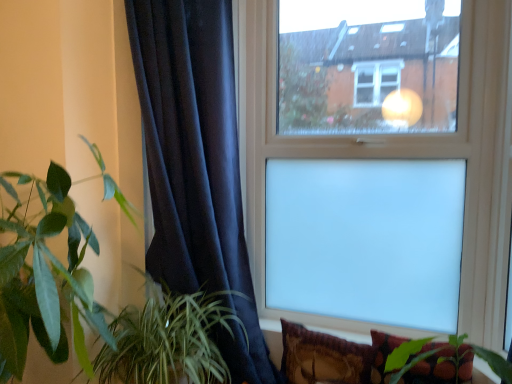
From the picture: What is the approximate width of velvet floral pillow at lower right, the 2th pillow positioned from the left?

velvet floral pillow at lower right, the 2th pillow positioned from the left, is 3.59 inches wide.

Where is `velvet-like brown pillow at lower right, placed as the 1th pillow when sorted from left to right`? velvet-like brown pillow at lower right, placed as the 1th pillow when sorted from left to right is located at coordinates (323, 357).

Describe the element at coordinates (197, 165) in the screenshot. I see `velvet dark blue curtain at left` at that location.

The height and width of the screenshot is (384, 512). In order to click on velvet dark blue curtain at left in this screenshot , I will do `click(197, 165)`.

What is the approximate width of green leafy plant at left, acting as the first houseplant starting from the left?

The width of green leafy plant at left, acting as the first houseplant starting from the left, is 30.89 inches.

The width and height of the screenshot is (512, 384). Find the location of `velvet floral pillow at lower right, which is counted as the first pillow, starting from the right`. velvet floral pillow at lower right, which is counted as the first pillow, starting from the right is located at coordinates (441, 366).

Is point (444, 383) less distant than point (11, 334)?

No.

How many degrees apart are the facing directions of velvet floral pillow at lower right, the 2th pillow positioned from the left, and green leafy plant at left, which is the 2th houseplant in right-to-left order?

0.24 degrees separate the facing orientations of velvet floral pillow at lower right, the 2th pillow positioned from the left, and green leafy plant at left, which is the 2th houseplant in right-to-left order.

From the image's perspective, is velvet floral pillow at lower right, which is counted as the first pillow, starting from the right, on top of green leafy plant at left, which is the 2th houseplant in right-to-left order?

No, from the image's perspective, velvet floral pillow at lower right, which is counted as the first pillow, starting from the right, is not above green leafy plant at left, which is the 2th houseplant in right-to-left order.

Is velvet floral pillow at lower right, which is counted as the first pillow, starting from the right, at the left side of green leafy plant at left, which is the 2th houseplant in right-to-left order?

No.

Looking at this image, is velvet floral pillow at lower right, which is counted as the first pillow, starting from the right, not close to transparent glass window at upper center?

That's not correct — velvet floral pillow at lower right, which is counted as the first pillow, starting from the right, is a little close to transparent glass window at upper center.

Which object is closer to the camera, velvet floral pillow at lower right, which is counted as the first pillow, starting from the right, or transparent glass window at upper center?

velvet floral pillow at lower right, which is counted as the first pillow, starting from the right, is more forward.

Does velvet floral pillow at lower right, which is counted as the first pillow, starting from the right, appear on the right side of transparent glass window at upper center?

Correct, you'll find velvet floral pillow at lower right, which is counted as the first pillow, starting from the right, to the right of transparent glass window at upper center.

The image size is (512, 384). In order to click on window above the velvet floral pillow at lower right, which is counted as the first pillow, starting from the right (from the image's perspective) in this screenshot , I will do tap(394, 157).

From the image's perspective, which object appears higher, velvet dark blue curtain at left or green leafy plant at left, acting as the first houseplant starting from the left?

From the image's view, velvet dark blue curtain at left is above.

Considering the relative sizes of velvet dark blue curtain at left and green leafy plant at left, which is the 2th houseplant in right-to-left order, in the image provided, is velvet dark blue curtain at left bigger than green leafy plant at left, which is the 2th houseplant in right-to-left order,?

No, velvet dark blue curtain at left is not bigger than green leafy plant at left, which is the 2th houseplant in right-to-left order.

Based on their positions, is velvet dark blue curtain at left located to the left or right of green leafy plant at left, acting as the first houseplant starting from the left?

In the image, velvet dark blue curtain at left appears on the right side of green leafy plant at left, acting as the first houseplant starting from the left.

Considering the relative sizes of velvet dark blue curtain at left and green leafy plant at left, which is the 2th houseplant in right-to-left order, in the image provided, is velvet dark blue curtain at left thinner than green leafy plant at left, which is the 2th houseplant in right-to-left order,?

Indeed, velvet dark blue curtain at left has a lesser width compared to green leafy plant at left, which is the 2th houseplant in right-to-left order.

Is green leafy plant at left, which is the 2th houseplant in right-to-left order, aimed at velvet floral pillow at lower right, the 2th pillow positioned from the left?

No, green leafy plant at left, which is the 2th houseplant in right-to-left order, is not oriented towards velvet floral pillow at lower right, the 2th pillow positioned from the left.

Does green leafy plant at left, which is the 2th houseplant in right-to-left order, lie in front of velvet floral pillow at lower right, the 2th pillow positioned from the left?

Yes, green leafy plant at left, which is the 2th houseplant in right-to-left order, is closer to the camera.

This screenshot has height=384, width=512. In order to click on the 2nd houseplant to the left of the velvet floral pillow at lower right, the 2th pillow positioned from the left, starting your count from the anchor in this screenshot , I will do `click(49, 270)`.

From a real-world perspective, is green leafy plant at left, which is the 2th houseplant in right-to-left order, physically below velvet floral pillow at lower right, the 2th pillow positioned from the left?

No.

Is point (343, 344) positioned behind point (89, 244)?

Yes, it is.

Is velvet-like brown pillow at lower right, placed as the 1th pillow when sorted from left to right, smaller than green leafy plant at left, acting as the first houseplant starting from the left?

Correct, velvet-like brown pillow at lower right, placed as the 1th pillow when sorted from left to right, occupies less space than green leafy plant at left, acting as the first houseplant starting from the left.

Where is `the 2nd pillow positioned below the green leafy plant at left, acting as the first houseplant starting from the left (from the image's perspective)`? The height and width of the screenshot is (384, 512). the 2nd pillow positioned below the green leafy plant at left, acting as the first houseplant starting from the left (from the image's perspective) is located at coordinates (323, 357).

Is velvet-like brown pillow at lower right, placed as the 1th pillow when sorted from left to right, positioned with its back to green leafy plant at left, acting as the first houseplant starting from the left?

No, velvet-like brown pillow at lower right, placed as the 1th pillow when sorted from left to right, is not facing away from green leafy plant at left, acting as the first houseplant starting from the left.

Is transparent glass window at upper center to the left or to the right of velvet-like brown pillow at lower right, positioned as the 2th pillow in right-to-left order, in the image?

Clearly, transparent glass window at upper center is on the right of velvet-like brown pillow at lower right, positioned as the 2th pillow in right-to-left order, in the image.

Relative to velvet-like brown pillow at lower right, placed as the 1th pillow when sorted from left to right, is transparent glass window at upper center in front or behind?

transparent glass window at upper center is positioned closer to the viewer than velvet-like brown pillow at lower right, placed as the 1th pillow when sorted from left to right.

Which of these two, transparent glass window at upper center or velvet-like brown pillow at lower right, placed as the 1th pillow when sorted from left to right, is smaller?

velvet-like brown pillow at lower right, placed as the 1th pillow when sorted from left to right.

Does green leafy plant at lower left, positioned as the second houseplant in left-to-right order, have a greater width compared to transparent glass window at upper center?

Indeed, green leafy plant at lower left, positioned as the second houseplant in left-to-right order, has a greater width compared to transparent glass window at upper center.

Is transparent glass window at upper center surrounded by green leafy plant at lower left, the 1th houseplant viewed from the right?

No.

Is green leafy plant at lower left, positioned as the second houseplant in left-to-right order, looking in the opposite direction of transparent glass window at upper center?

green leafy plant at lower left, positioned as the second houseplant in left-to-right order, is not turned away from transparent glass window at upper center.

Starting from the transparent glass window at upper center, which houseplant is the 1st one to the left? Please provide its 2D coordinates.

[(168, 339)]

Identify the location of the 1st pillow behind when counting from the green leafy plant at left, acting as the first houseplant starting from the left. (441, 366).

From the image's perspective, starting from the transparent glass window at upper center, which pillow is the 1st one below? Please provide its 2D coordinates.

[(441, 366)]

When comparing their distances from velvet dark blue curtain at left, does green leafy plant at left, which is the 2th houseplant in right-to-left order, or green leafy plant at lower left, the 1th houseplant viewed from the right, seem further?

green leafy plant at left, which is the 2th houseplant in right-to-left order, is further to velvet dark blue curtain at left.

Looking at the image, which one is located further to velvet floral pillow at lower right, which is counted as the first pillow, starting from the right, velvet-like brown pillow at lower right, placed as the 1th pillow when sorted from left to right, or transparent glass window at upper center?

transparent glass window at upper center.

When comparing their distances from green leafy plant at left, acting as the first houseplant starting from the left, does green leafy plant at lower left, the 1th houseplant viewed from the right, or velvet dark blue curtain at left seem further?

velvet dark blue curtain at left is further to green leafy plant at left, acting as the first houseplant starting from the left.

When comparing their distances from transparent glass window at upper center, does velvet dark blue curtain at left or green leafy plant at left, acting as the first houseplant starting from the left, seem further?

green leafy plant at left, acting as the first houseplant starting from the left, lies further to transparent glass window at upper center than the other object.

From the image, which object appears to be farther from green leafy plant at left, acting as the first houseplant starting from the left, transparent glass window at upper center or velvet dark blue curtain at left?

transparent glass window at upper center lies further to green leafy plant at left, acting as the first houseplant starting from the left, than the other object.

Considering their positions, is velvet floral pillow at lower right, which is counted as the first pillow, starting from the right, positioned further to green leafy plant at left, acting as the first houseplant starting from the left, than transparent glass window at upper center?

The object further to green leafy plant at left, acting as the first houseplant starting from the left, is transparent glass window at upper center.

Considering their positions, is velvet-like brown pillow at lower right, positioned as the 2th pillow in right-to-left order, positioned further to velvet floral pillow at lower right, the 2th pillow positioned from the left, than green leafy plant at left, acting as the first houseplant starting from the left?

green leafy plant at left, acting as the first houseplant starting from the left, lies further to velvet floral pillow at lower right, the 2th pillow positioned from the left, than the other object.

Looking at the image, which one is located closer to velvet floral pillow at lower right, which is counted as the first pillow, starting from the right, velvet dark blue curtain at left or green leafy plant at left, acting as the first houseplant starting from the left?

velvet dark blue curtain at left is positioned closer to the anchor velvet floral pillow at lower right, which is counted as the first pillow, starting from the right.

Where is `curtain between transparent glass window at upper center and velvet floral pillow at lower right, which is counted as the first pillow, starting from the right, from top to bottom`? This screenshot has width=512, height=384. curtain between transparent glass window at upper center and velvet floral pillow at lower right, which is counted as the first pillow, starting from the right, from top to bottom is located at coordinates (197, 165).

You are a GUI agent. You are given a task and a screenshot of the screen. Output one action in this format:
    pyautogui.click(x=<x>, y=<y>)
    Task: Click on the pillow between green leafy plant at lower left, positioned as the second houseplant in left-to-right order, and velvet floral pillow at lower right, the 2th pillow positioned from the left, from left to right
    This screenshot has width=512, height=384.
    Given the screenshot: What is the action you would take?
    pyautogui.click(x=323, y=357)

This screenshot has width=512, height=384. In order to click on window between green leafy plant at lower left, the 1th houseplant viewed from the right, and velvet floral pillow at lower right, the 2th pillow positioned from the left, from left to right in this screenshot , I will do `click(394, 157)`.

Find the location of a particular element. This screenshot has width=512, height=384. houseplant located between green leafy plant at left, which is the 2th houseplant in right-to-left order, and velvet floral pillow at lower right, which is counted as the first pillow, starting from the right, in the left-right direction is located at coordinates coord(168,339).